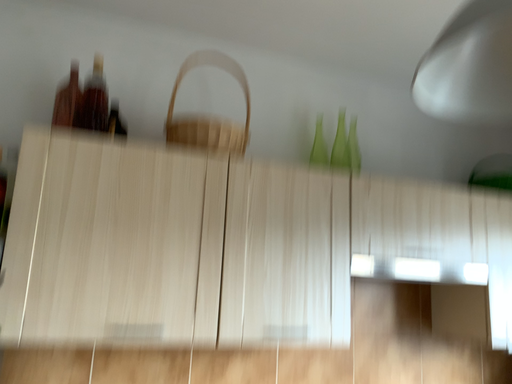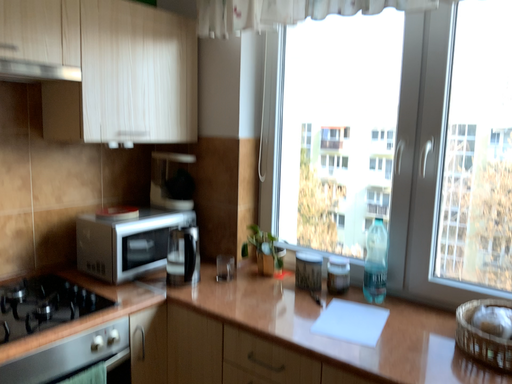
Question: How did the camera likely rotate when shooting the video?

Choices:
 (A) rotated left
 (B) rotated right

Answer: (B)